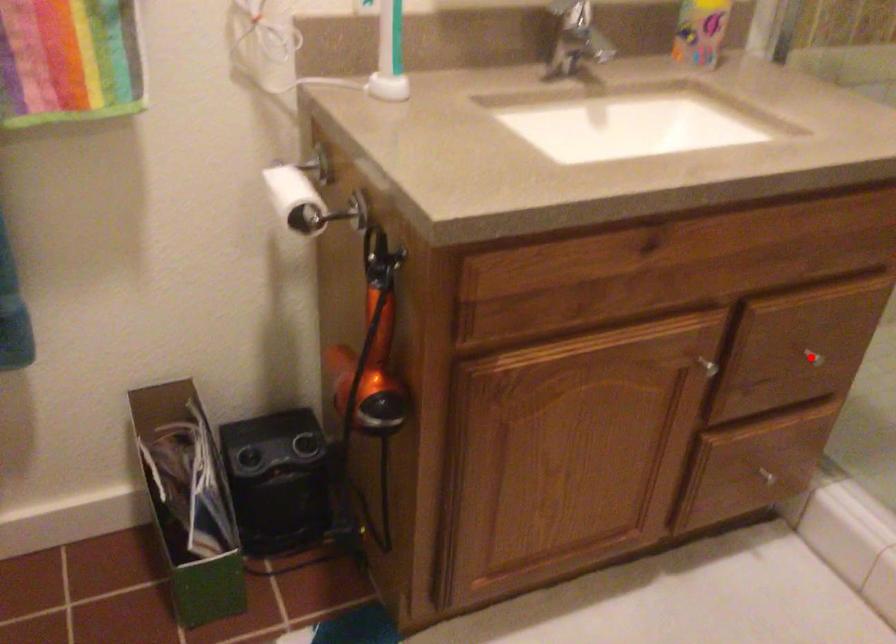
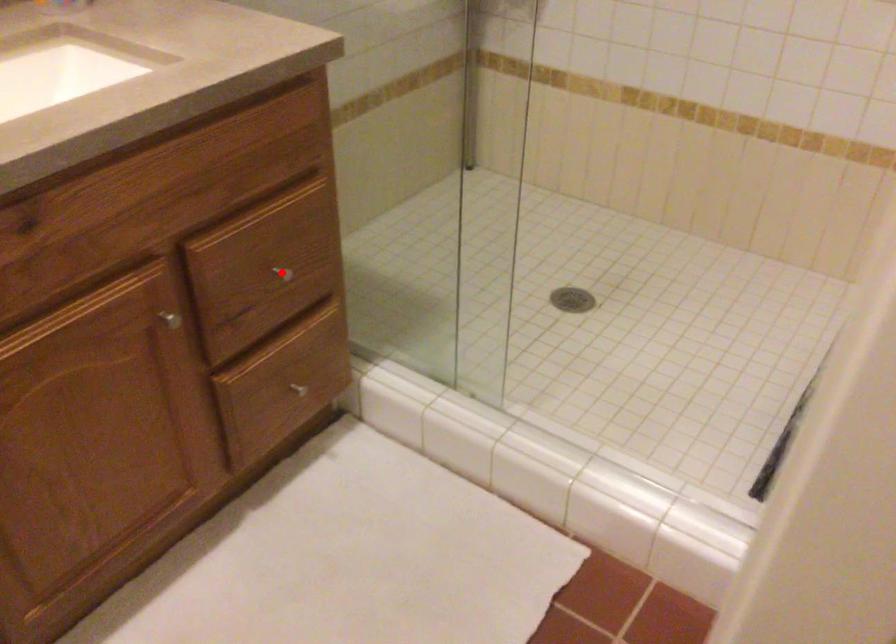
I am providing you with two images of the same scene from different viewpoints. A red point is marked on the first image and another point is marked on the second image. Is the red point in image1 aligned with the point shown in image2?

Yes